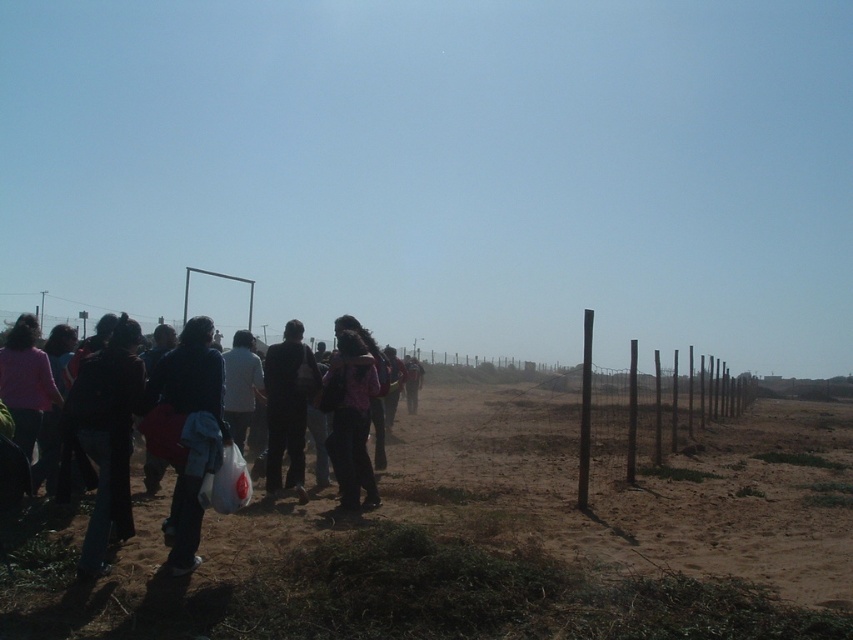
You are a photographer trying to capture a wide shot of the group of people walking along the dirt path. Since you want to include both the brown wooden fence at right and the dark blue fabric jacket at left in the frame, which object should you focus on to ensure both are in the shot?

The brown wooden fence at right is larger in size than the dark blue fabric jacket at left, so focusing on the brown wooden fence at right will help ensure both objects are included in the frame.

You are a photographer trying to capture a group photo of the dark blue suit at center and the brown wooden fence at right. Which object should you focus on first if you want to ensure both are in focus without adjusting your camera settings?

The brown wooden fence at right is bigger than the dark blue suit at center, so you should focus on the brown wooden fence at right first as it is larger and will require more precise focus to ensure both are in focus.